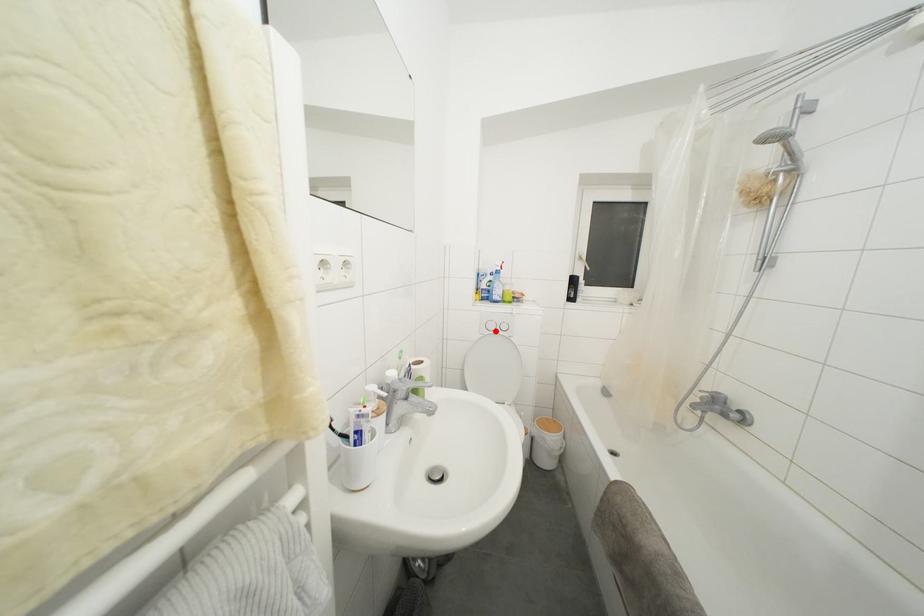
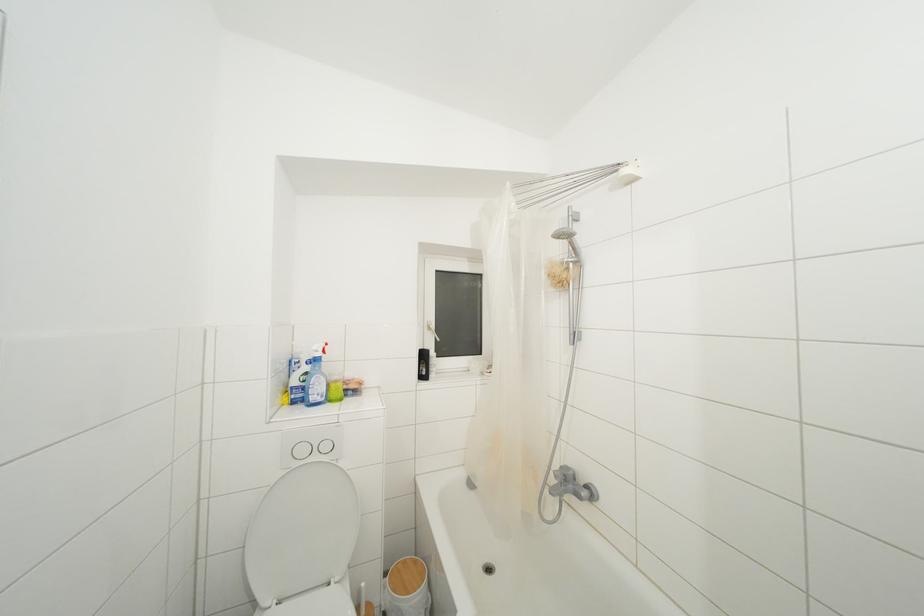
Question: I am providing you with two images of the same scene from different viewpoints. A red point is marked on the first image. At the location where the point appears in image 1, is it still visible in image 2?

Choices:
 (A) Yes
 (B) No

Answer: (A)